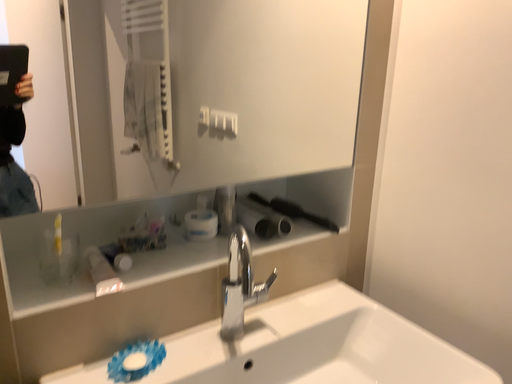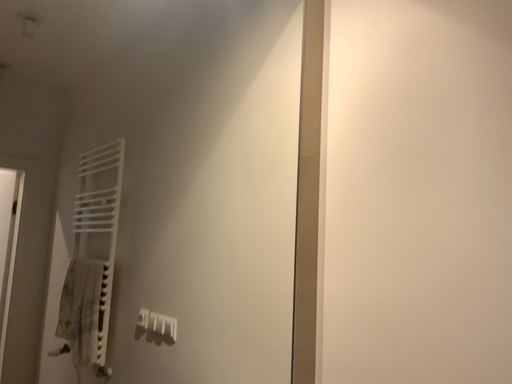
Question: How did the camera likely rotate when shooting the video?

Choices:
 (A) rotated right
 (B) rotated left

Answer: (A)